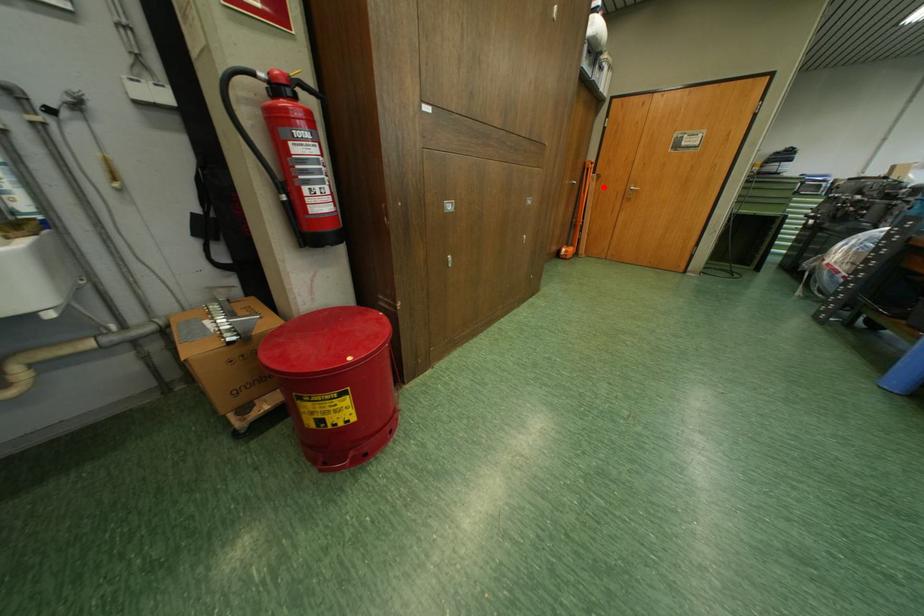
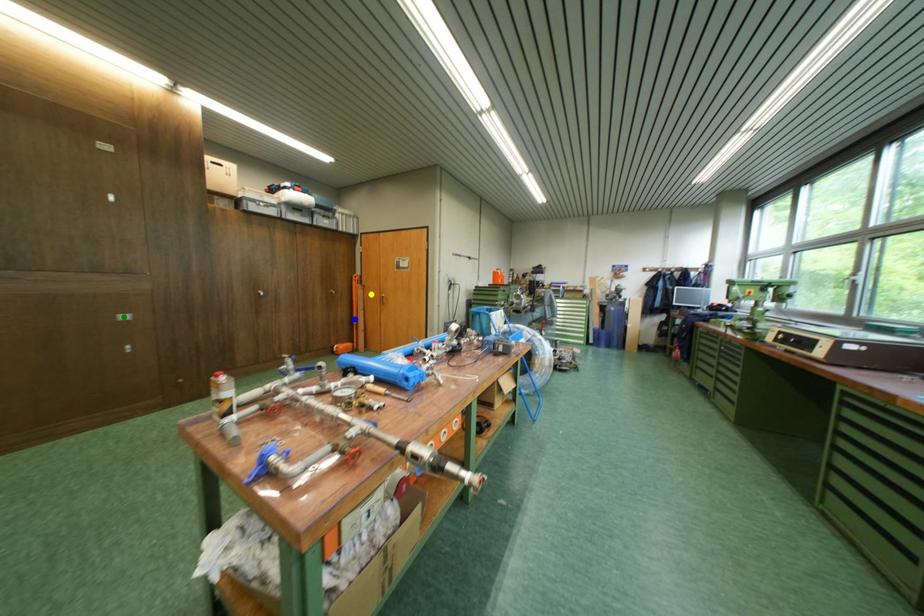
Question: I am providing you with two images of the same scene from different viewpoints. A red point is marked on the first image. You are given multiple points on the second image. Which spot in image 2 lines up with the point in image 1?

Choices:
 (A) blue point
 (B) yellow point
 (C) green point

Answer: (B)